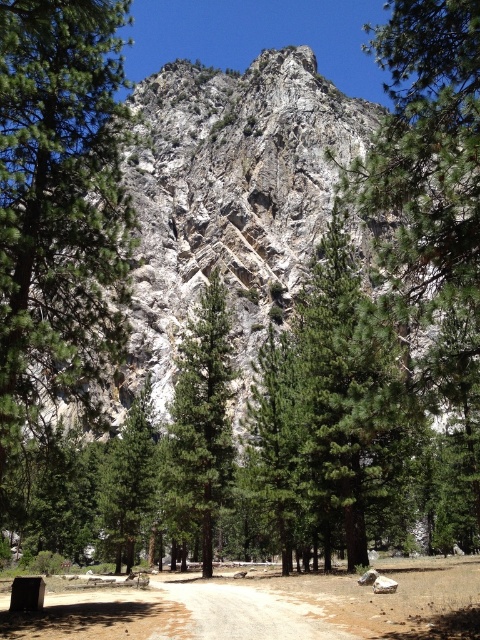
How distant is rocky cliff at center from brown dirt track at center?

The distance of rocky cliff at center from brown dirt track at center is 232.11 feet.

Between point (264, 304) and point (420, 579), which one is positioned in front?

Point (420, 579) is in front.

Between point (163, 353) and point (414, 580), which one is positioned behind?

The point (163, 353) is behind.

Where is `rocky cliff at center`? The height and width of the screenshot is (640, 480). rocky cliff at center is located at coordinates (229, 200).

Based on the photo, who is lower down, rocky cliff at center or green textured tree at center?

Positioned lower is green textured tree at center.

Locate an element on the screen. rocky cliff at center is located at coordinates (229, 200).

Which is more to the right, brown dirt track at center or green textured tree at center?

From the viewer's perspective, brown dirt track at center appears more on the right side.

Locate an element on the screen. This screenshot has height=640, width=480. brown dirt track at center is located at coordinates (265, 608).

The image size is (480, 640). I want to click on brown dirt track at center, so click(265, 608).